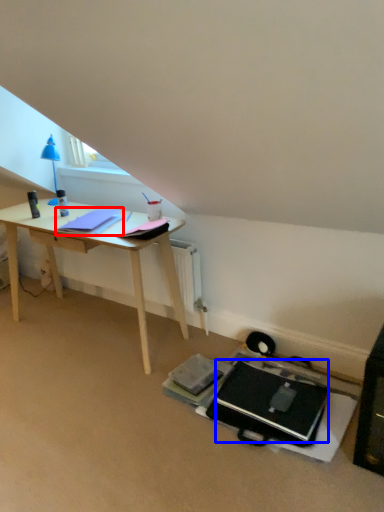
Question: Which point is closer to the camera, notepad (highlighted by a red box) or laptop (highlighted by a blue box)?

Choices:
 (A) notepad
 (B) laptop

Answer: (B)